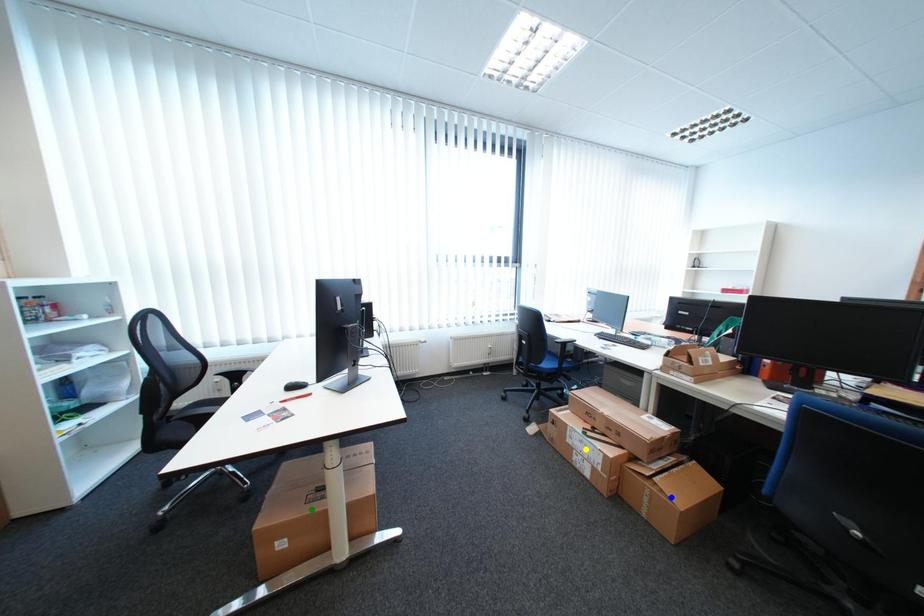
Order these from farthest to nearest:
- blue point
- yellow point
- green point

yellow point < blue point < green point